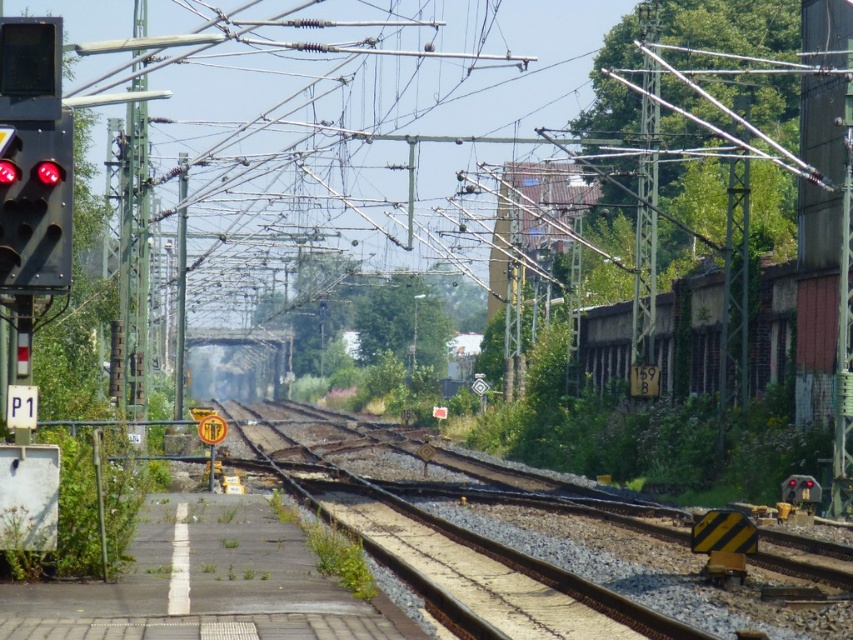
Question: Does green metallic pole at center-right appear under metallic pole at center?

Choices:
 (A) no
 (B) yes

Answer: (A)

Question: Among these points, which one is nearest to the camera?

Choices:
 (A) (21, 45)
 (B) (654, 20)

Answer: (A)

Question: Does brown gravel train track at center have a lesser width compared to black matte traffic light at left?

Choices:
 (A) yes
 (B) no

Answer: (B)

Question: Which object is the closest to the black matte traffic light at left?

Choices:
 (A) green metallic pole at center-right
 (B) metallic pole at center
 (C) brown gravel train track at center

Answer: (C)

Question: Does brown gravel train track at center come in front of metallic pole at center?

Choices:
 (A) yes
 (B) no

Answer: (A)

Question: Which object is positioned closest to the brown gravel train track at center?

Choices:
 (A) green metallic pole at center-right
 (B) black matte traffic light at left

Answer: (B)